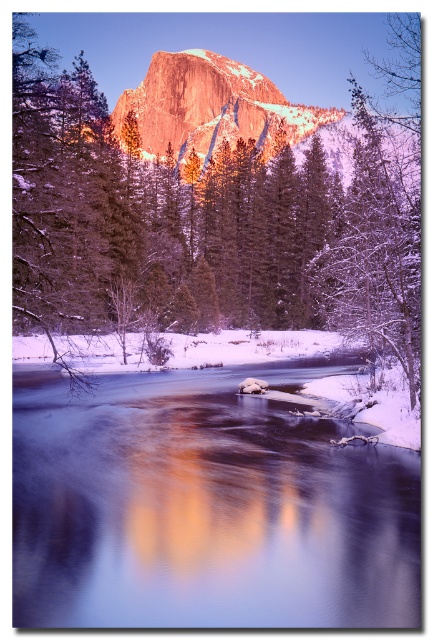
Looking at this image, you are standing at the riverside and want to take a photo of both the snowy evergreen tree at center and the shiny granite mountain at center. Which object should you adjust your camera angle upwards to include in the frame?

You should adjust your camera angle upwards to include the shiny granite mountain at center because the snowy evergreen tree at center is positioned over it, meaning the tree is closer to the camera and the mountain is behind and below it.

You are standing at the riverside and want to take a photo of both the snowy evergreen tree at center and the shiny granite mountain at center. Which object should you focus on first to ensure both are in sharp focus?

You should focus on the snowy evergreen tree at center first since it is closer to the viewer than the shiny granite mountain at center. By focusing on the closer object, the mountain in the background will still be in focus due to the depth of field.